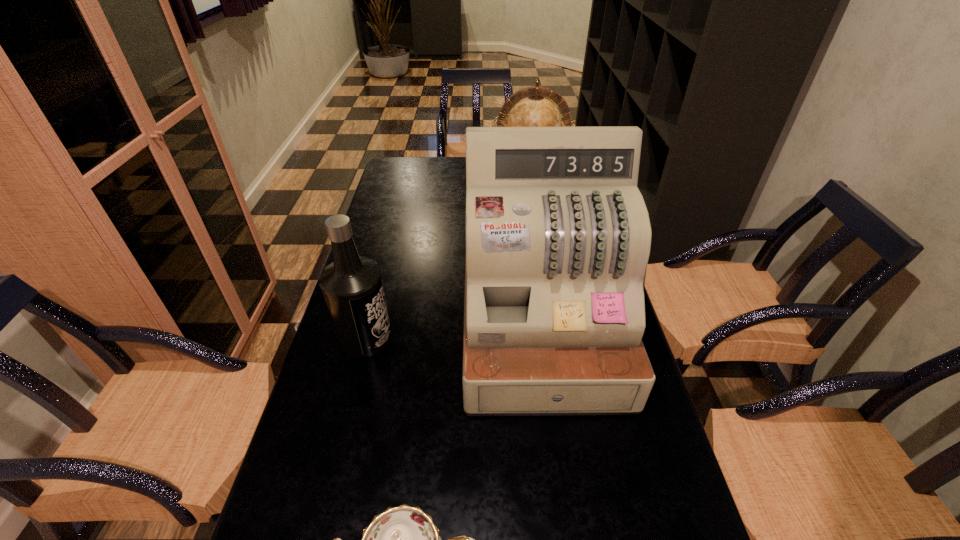
Identify the location of the tallest object. pos(558,236).

This screenshot has width=960, height=540. What are the coordinates of `the farthest object` in the screenshot? It's located at (529, 107).

Image resolution: width=960 pixels, height=540 pixels. I want to click on liquor, so click(x=352, y=286).

Where is `vacant space situated on the operating side of the tallest object`? The image size is (960, 540). vacant space situated on the operating side of the tallest object is located at coordinates pyautogui.click(x=568, y=528).

Where is `vacant region located on the front-facing side of the farthest object`? The height and width of the screenshot is (540, 960). vacant region located on the front-facing side of the farthest object is located at coordinates (538, 225).

At what (x,y) coordinates should I click in order to perform the action: click on free region located on the front label of the liquor. Please return your answer as a coordinate pair (x, y). The image size is (960, 540). Looking at the image, I should click on (495, 338).

Locate an element on the screen. Image resolution: width=960 pixels, height=540 pixels. object at the far edge is located at coordinates (529, 107).

Locate an element on the screen. The width and height of the screenshot is (960, 540). object positioned at the left edge is located at coordinates (352, 286).

Image resolution: width=960 pixels, height=540 pixels. In order to click on cash register that is at the right edge in this screenshot , I will do `click(558, 236)`.

At what (x,y) coordinates should I click in order to perform the action: click on globe positioned at the right edge. Please return your answer as a coordinate pair (x, y). This screenshot has height=540, width=960. Looking at the image, I should click on (529, 107).